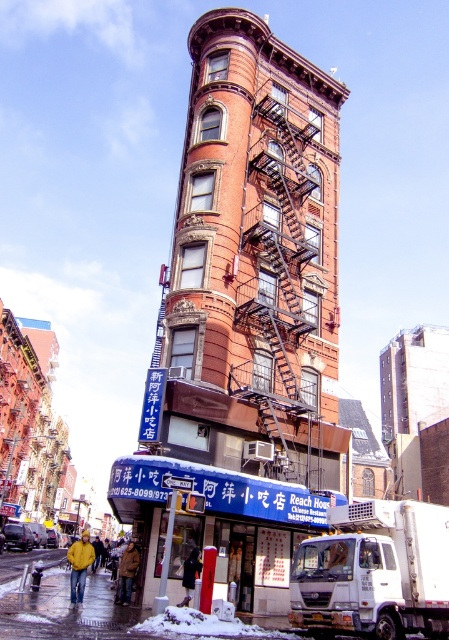
Question: Estimate the real-world distances between objects in this image. Which object is farther from the black metal fire escape at center?

Choices:
 (A) white matte truck at lower right
 (B) rusty metal fire escape at center

Answer: (A)

Question: Which object is the closest to the black metal fire escape at center?

Choices:
 (A) rusty metal fire escape at center
 (B) white matte truck at lower right

Answer: (A)

Question: Which object appears farthest from the camera in this image?

Choices:
 (A) white matte truck at lower right
 (B) black metal fire escape at center

Answer: (B)

Question: Does rusty metal fire escape at center appear on the right side of black metal fire escape at center?

Choices:
 (A) no
 (B) yes

Answer: (A)

Question: Can you confirm if rusty metal fire escape at center is positioned above white matte truck at lower right?

Choices:
 (A) yes
 (B) no

Answer: (A)

Question: Is rusty metal fire escape at center thinner than white matte truck at lower right?

Choices:
 (A) yes
 (B) no

Answer: (B)